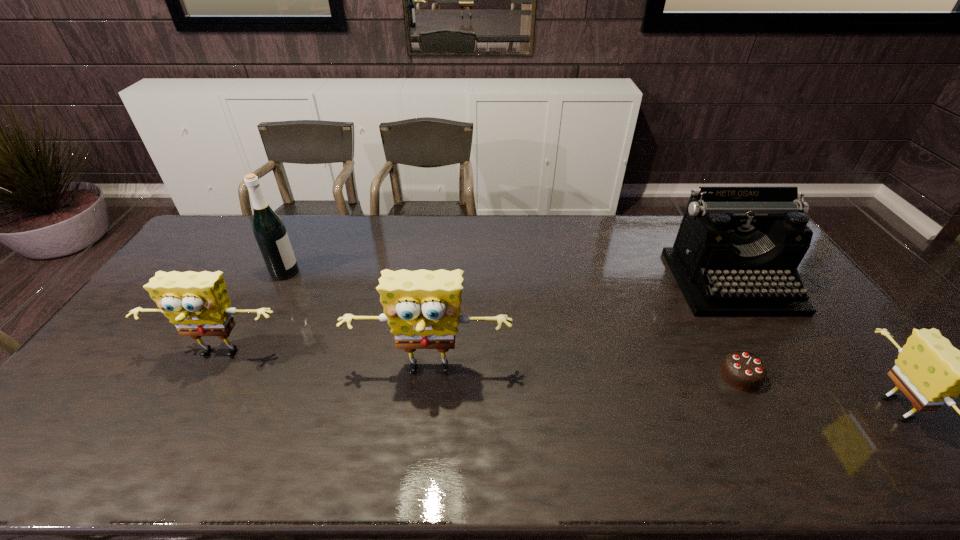
At what (x,y) coordinates should I click in order to perform the action: click on the leftmost sponge. Please return your answer as a coordinate pair (x, y). Looking at the image, I should click on (197, 303).

Locate an element on the screen. This screenshot has height=540, width=960. the second sponge from left to right is located at coordinates (422, 307).

This screenshot has height=540, width=960. In order to click on typewriter in this screenshot , I will do `click(736, 253)`.

The width and height of the screenshot is (960, 540). Find the location of `chocolate cake`. chocolate cake is located at coordinates (743, 370).

This screenshot has height=540, width=960. Identify the location of wine bottle. (269, 230).

You are a GUI agent. You are given a task and a screenshot of the screen. Output one action in this format:
    pyautogui.click(x=<x>, y=<y>)
    Task: Click on the free space located 0.060m on the face of the leftmost sponge
    
    Given the screenshot: What is the action you would take?
    pyautogui.click(x=199, y=392)

I want to click on free space located 0.300m on the typing side of the typewriter, so click(x=808, y=402).

This screenshot has height=540, width=960. Find the location of `free space located on the left of the shortest object`. free space located on the left of the shortest object is located at coordinates (602, 375).

The width and height of the screenshot is (960, 540). I want to click on free spot located 0.160m on the label of the wine bottle, so click(346, 272).

Find the location of `object located at the left edge`. object located at the left edge is located at coordinates (197, 303).